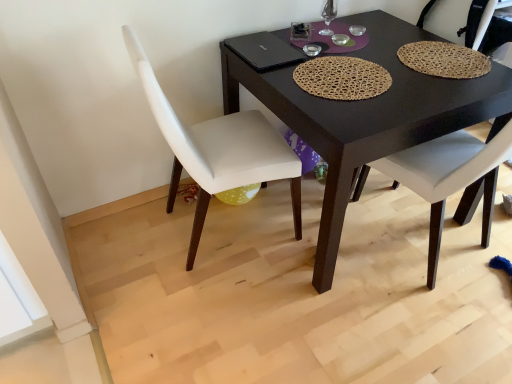
This screenshot has width=512, height=384. Identify the location of free space between white leather chair at lower left, the 2th chair when ordered from right to left, and black matte table at center. (256, 274).